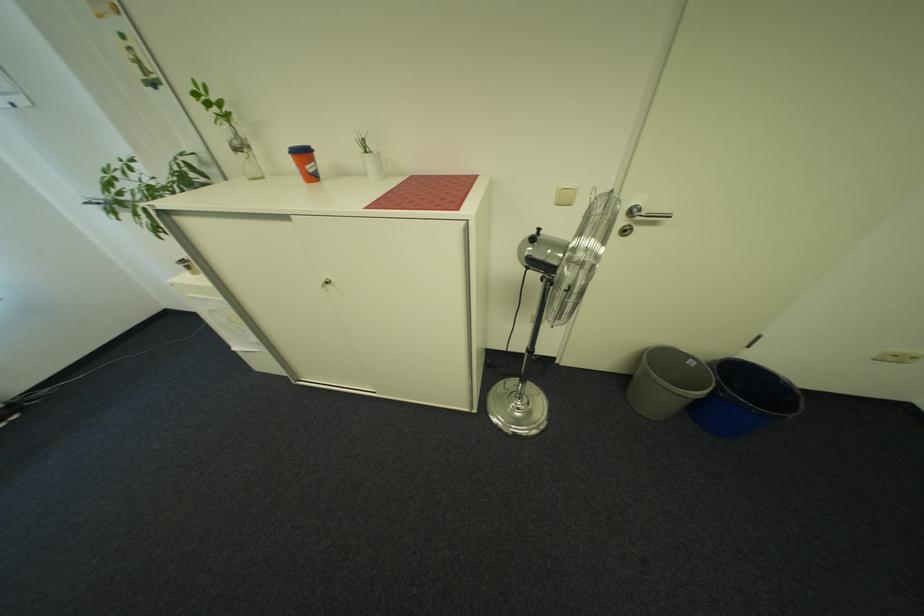
This screenshot has width=924, height=616. Describe the element at coordinates (646, 214) in the screenshot. I see `the silver door handle` at that location.